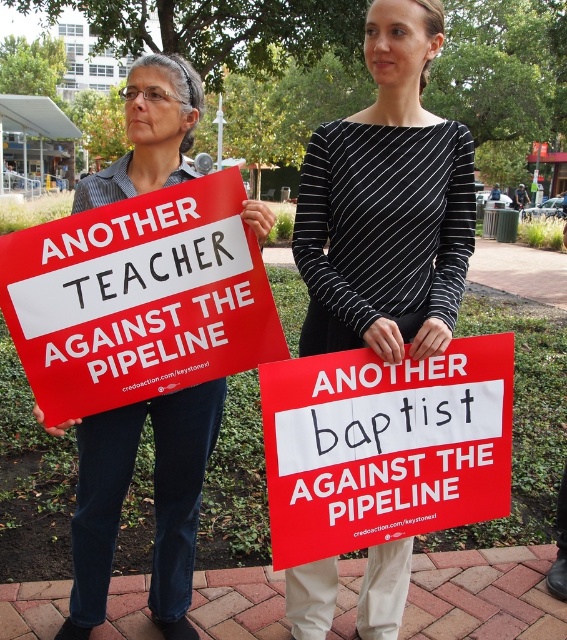
Which is more to the right, black striped shirt at center or red matte sign at left?

black striped shirt at center

Is black striped shirt at center thinner than red matte sign at left?

Yes.

Does point (459, 148) come farther from viewer compared to point (43, 232)?

Yes, it is.

I want to click on black striped shirt at center, so click(387, 204).

Can you confirm if black striped shirt at center is positioned above matte black shirt at center?

Yes, black striped shirt at center is above matte black shirt at center.

Image resolution: width=567 pixels, height=640 pixels. What do you see at coordinates (387, 204) in the screenshot? I see `black striped shirt at center` at bounding box center [387, 204].

Identify the location of black striped shirt at center. The image size is (567, 640). (387, 204).

Who is positioned more to the left, black striped shirt at center or red matte sign at center?

black striped shirt at center

Measure the distance between black striped shirt at center and camera.

black striped shirt at center and camera are 1.69 meters apart from each other.

Locate an element on the screen. Image resolution: width=567 pixels, height=640 pixels. black striped shirt at center is located at coordinates (387, 204).

The image size is (567, 640). Find the location of `black striped shirt at center`. black striped shirt at center is located at coordinates click(x=387, y=204).